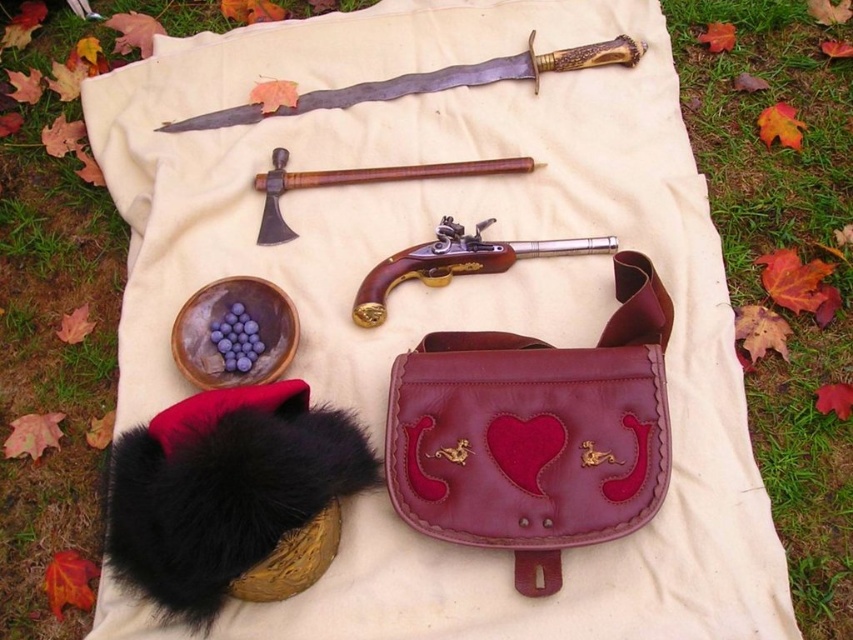
Is black fuzzy hat at lower left further to the viewer compared to polished wood and brass pistol at center?

No, black fuzzy hat at lower left is closer to the viewer.

Who is higher up, black fuzzy hat at lower left or polished wood and brass pistol at center?

polished wood and brass pistol at center is higher up.

Who is more distant from viewer, (207,547) or (440,276)?

Positioned behind is point (440,276).

At what (x,y) coordinates should I click in order to perform the action: click on black fuzzy hat at lower left. Please return your answer as a coordinate pair (x, y). Looking at the image, I should click on (224, 497).

Can you confirm if polished brass flintlock pistol at upper center is smaller than polished wood and brass pistol at center?

No, polished brass flintlock pistol at upper center is not smaller than polished wood and brass pistol at center.

Which is behind, point (618, 56) or point (375, 305)?

Point (618, 56)

You are a GUI agent. You are given a task and a screenshot of the screen. Output one action in this format:
    pyautogui.click(x=<x>, y=<y>)
    Task: Click on the polished brass flintlock pistol at upper center
    The image size is (853, 640).
    Given the screenshot: What is the action you would take?
    pyautogui.click(x=430, y=81)

Does point (376, 477) come in front of point (280, 168)?

Yes, point (376, 477) is in front of point (280, 168).

Who is higher up, black fuzzy hat at lower left or wooden handle at upper center?

wooden handle at upper center is above.

Locate an element on the screen. black fuzzy hat at lower left is located at coordinates (224, 497).

Identify the location of black fuzzy hat at lower left. This screenshot has width=853, height=640. [x=224, y=497].